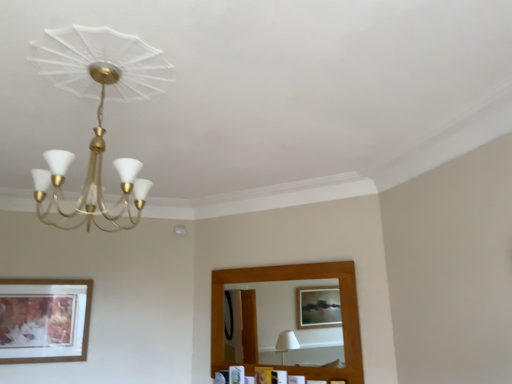
Question: Relative to matte gold chandelier at upper left, is wooden picture frame at lower center, positioned as the second picture frame in left-to-right order, in front or behind?

Choices:
 (A) behind
 (B) front

Answer: (A)

Question: In terms of size, does wooden picture frame at lower center, placed as the second picture frame when sorted from right to left, appear bigger or smaller than matte gold chandelier at upper left?

Choices:
 (A) big
 (B) small

Answer: (B)

Question: Which of these objects is positioned closest to the wooden picture frame at lower center, positioned as the second picture frame in left-to-right order?

Choices:
 (A) wooden picture frame at lower center, marked as the first picture frame in a right-to-left arrangement
 (B) wooden picture frame at lower left, the 3th picture frame from the right
 (C) matte gold chandelier at upper left

Answer: (A)

Question: Estimate the real-world distances between objects in this image. Which object is farther from the wooden picture frame at lower left, which is the 1th picture frame in left-to-right order?

Choices:
 (A) wooden picture frame at lower center, marked as the first picture frame in a right-to-left arrangement
 (B) wooden picture frame at lower center, positioned as the second picture frame in left-to-right order
 (C) matte gold chandelier at upper left

Answer: (A)